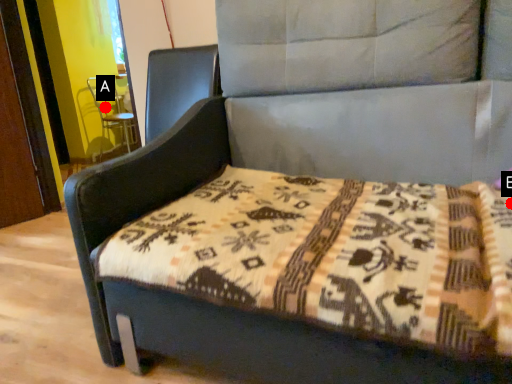
Question: Two points are circled on the image, labeled by A and B beside each circle. Which point is farther to the camera?

Choices:
 (A) A is further
 (B) B is further

Answer: (A)